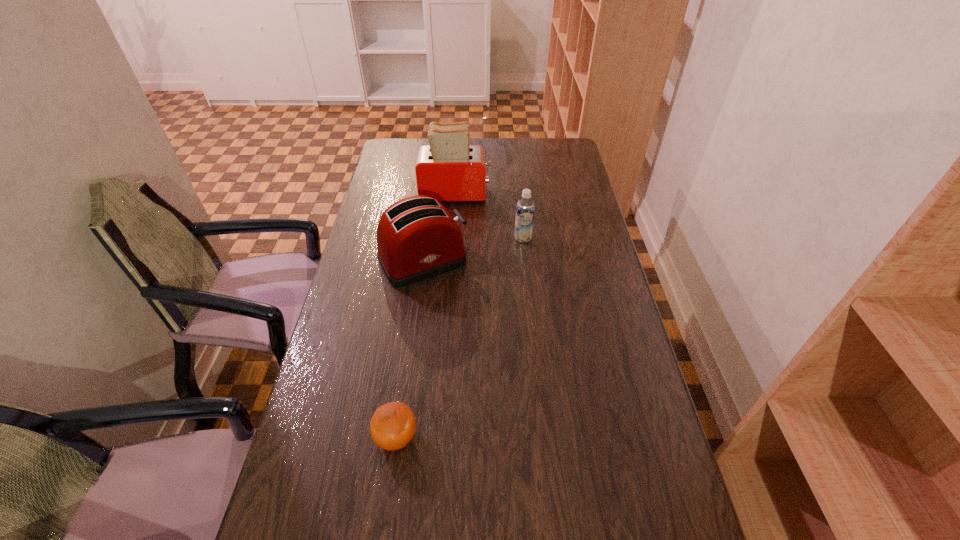
Where is `object that is at the left edge`? The image size is (960, 540). object that is at the left edge is located at coordinates (417, 238).

This screenshot has width=960, height=540. Find the location of `vacant space at the far edge of the desktop`. vacant space at the far edge of the desktop is located at coordinates (537, 147).

In the image, there is a desktop. Identify the location of vacant space at the left edge. (359, 268).

Where is `free location at the right edge`? free location at the right edge is located at coordinates (581, 239).

The height and width of the screenshot is (540, 960). I want to click on free location at the far left corner of the desktop, so click(388, 139).

Identify the location of empty space that is in between the orange and the soya milk. This screenshot has height=540, width=960. (460, 338).

Find the location of `vacant point located between the orange and the soya milk`. vacant point located between the orange and the soya milk is located at coordinates (460, 338).

Locate an element on the screen. free area in between the shorter toaster and the nearest object is located at coordinates (410, 349).

In order to click on unoccupied area between the farther toaster and the rightmost object in this screenshot , I will do `click(490, 216)`.

Image resolution: width=960 pixels, height=540 pixels. I want to click on blank region between the taller toaster and the rightmost object, so click(x=490, y=216).